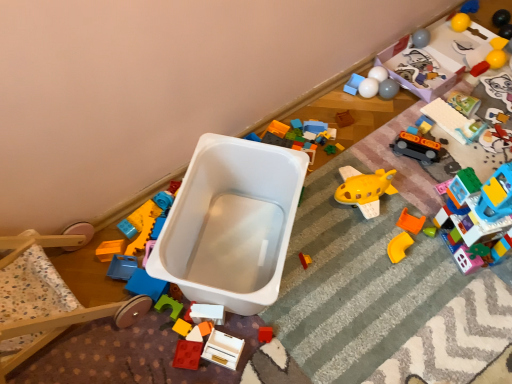
Question: In which direction should I rotate to look at matte yellow toy airplane at center, arranged as the 5th toy when viewed from the left?

Choices:
 (A) right
 (B) left

Answer: (A)

Question: From a real-world perspective, is white plastic baby carriage at center located beneath orange matte plastic corner piece at lower right, the eighth toy positioned from the left?

Choices:
 (A) yes
 (B) no

Answer: (B)

Question: Does white plastic baby carriage at center come behind orange matte plastic corner piece at lower right, the ninth toy positioned from the right?

Choices:
 (A) no
 (B) yes

Answer: (A)

Question: From the image's perspective, is white plastic baby carriage at center on orange matte plastic corner piece at lower right, the eighth toy positioned from the left?

Choices:
 (A) yes
 (B) no

Answer: (A)

Question: From a real-world perspective, is white plastic baby carriage at center positioned over orange matte plastic corner piece at lower right, the ninth toy positioned from the right, based on gravity?

Choices:
 (A) yes
 (B) no

Answer: (A)

Question: Does white plastic baby carriage at center have a larger size compared to orange matte plastic corner piece at lower right, the ninth toy positioned from the right?

Choices:
 (A) no
 (B) yes

Answer: (B)

Question: From the image's perspective, is white plastic baby carriage at center under orange matte plastic corner piece at lower right, the eighth toy positioned from the left?

Choices:
 (A) no
 (B) yes

Answer: (A)

Question: Can we say orange matte plastic corner piece at lower right, the eighth toy positioned from the left, lies outside rubberized plastic block at center, the 1th toy positioned from the left?

Choices:
 (A) yes
 (B) no

Answer: (A)

Question: From the image's perspective, is orange matte plastic corner piece at lower right, the eighth toy positioned from the left, beneath rubberized plastic block at center, the sixteenth toy from the right?

Choices:
 (A) no
 (B) yes

Answer: (A)

Question: From the image's perspective, is orange matte plastic corner piece at lower right, the ninth toy positioned from the right, on rubberized plastic block at center, the sixteenth toy from the right?

Choices:
 (A) no
 (B) yes

Answer: (B)

Question: Does orange matte plastic corner piece at lower right, the ninth toy positioned from the right, have a greater width compared to rubberized plastic block at center, the 1th toy positioned from the left?

Choices:
 (A) yes
 (B) no

Answer: (A)

Question: Does orange matte plastic corner piece at lower right, the eighth toy positioned from the left, have a smaller size compared to rubberized plastic block at center, the 1th toy positioned from the left?

Choices:
 (A) no
 (B) yes

Answer: (A)

Question: Does orange matte plastic corner piece at lower right, the ninth toy positioned from the right, have a greater height compared to rubberized plastic block at center, the sixteenth toy from the right?

Choices:
 (A) yes
 (B) no

Answer: (B)

Question: Is white plastic toy at center, the 14th toy when ordered from right to left, placed right next to rubberized plastic toy car at upper right, which appears as the thirteenth toy when viewed from the left?

Choices:
 (A) no
 (B) yes

Answer: (A)